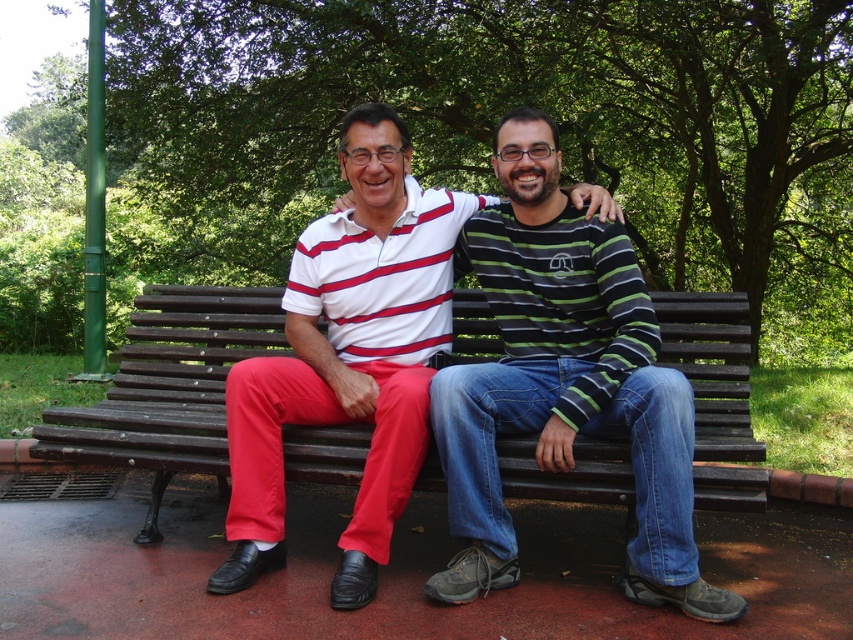
Does striped cotton shirt at center have a larger size compared to wooden bench at center?

Yes.

Is striped cotton shirt at center above wooden bench at center?

Yes.

Is point (466, 472) behind point (740, 490)?

Yes.

Locate an element on the screen. The height and width of the screenshot is (640, 853). striped cotton shirt at center is located at coordinates (564, 381).

Can you confirm if striped cotton shirt at center is wider than white striped polo shirt at center?

Indeed, striped cotton shirt at center has a greater width compared to white striped polo shirt at center.

Is striped cotton shirt at center shorter than white striped polo shirt at center?

No, striped cotton shirt at center is not shorter than white striped polo shirt at center.

The image size is (853, 640). I want to click on striped cotton shirt at center, so click(564, 381).

Image resolution: width=853 pixels, height=640 pixels. In order to click on striped cotton shirt at center in this screenshot , I will do `click(564, 381)`.

Is matte striped shirt at center below white striped polo shirt at center?

Indeed, matte striped shirt at center is positioned under white striped polo shirt at center.

Can you confirm if matte striped shirt at center is smaller than white striped polo shirt at center?

Incorrect, matte striped shirt at center is not smaller in size than white striped polo shirt at center.

Is point (339, 336) behind point (381, 328)?

Yes.

At what (x,y) coordinates should I click in order to perform the action: click on matte striped shirt at center. Please return your answer as a coordinate pair (x, y). The width and height of the screenshot is (853, 640). Looking at the image, I should click on click(347, 356).